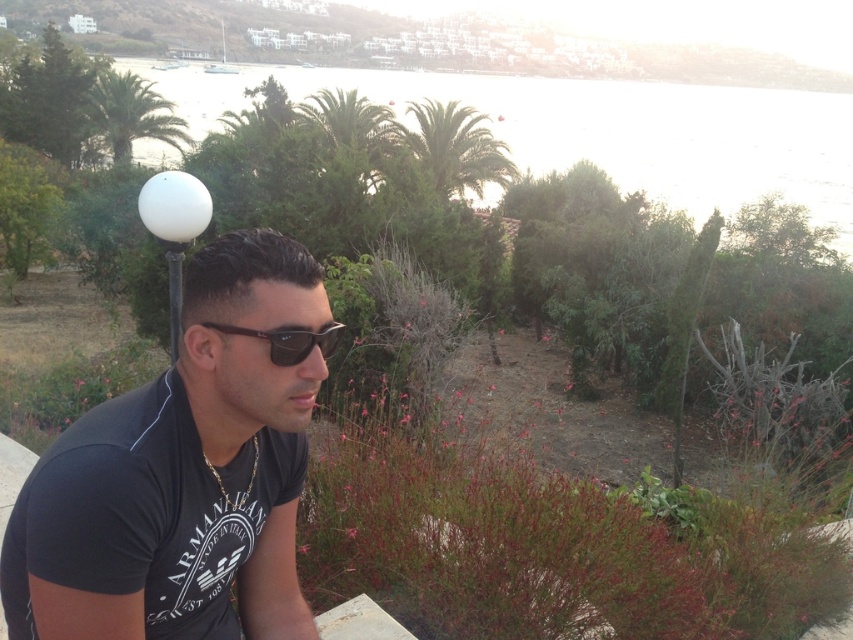
Can you confirm if black matte t-shirt at left is thinner than black plastic sunglasses at center?

In fact, black matte t-shirt at left might be wider than black plastic sunglasses at center.

Is point (30, 506) positioned before point (291, 353)?

Yes, it is.

Is point (273, 259) positioned before point (293, 362)?

No, (273, 259) is behind (293, 362).

At what (x,y) coordinates should I click in order to perform the action: click on black matte t-shirt at left. Please return your answer as a coordinate pair (x, y). Looking at the image, I should click on (184, 470).